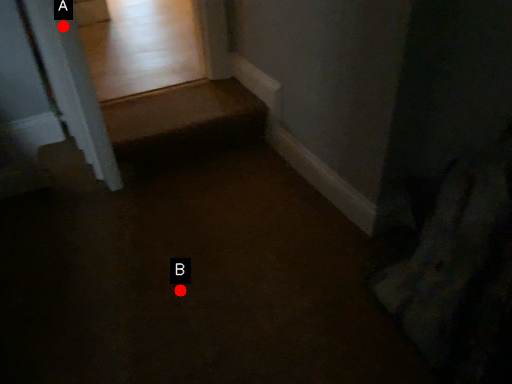
Question: Two points are circled on the image, labeled by A and B beside each circle. Which point is closer to the camera?

Choices:
 (A) A is closer
 (B) B is closer

Answer: (A)